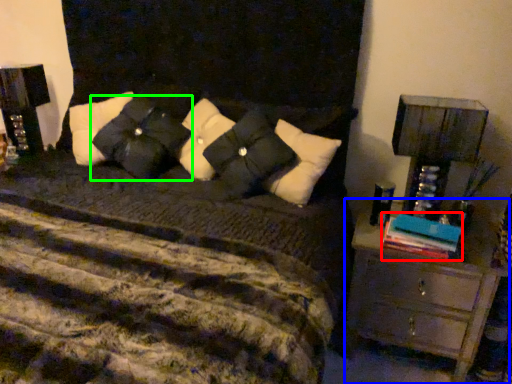
Question: Which object is positioned farthest from book (highlighted by a red box)? Select from chest of drawers (highlighted by a blue box) and pillow (highlighted by a green box).

Choices:
 (A) chest of drawers
 (B) pillow

Answer: (B)